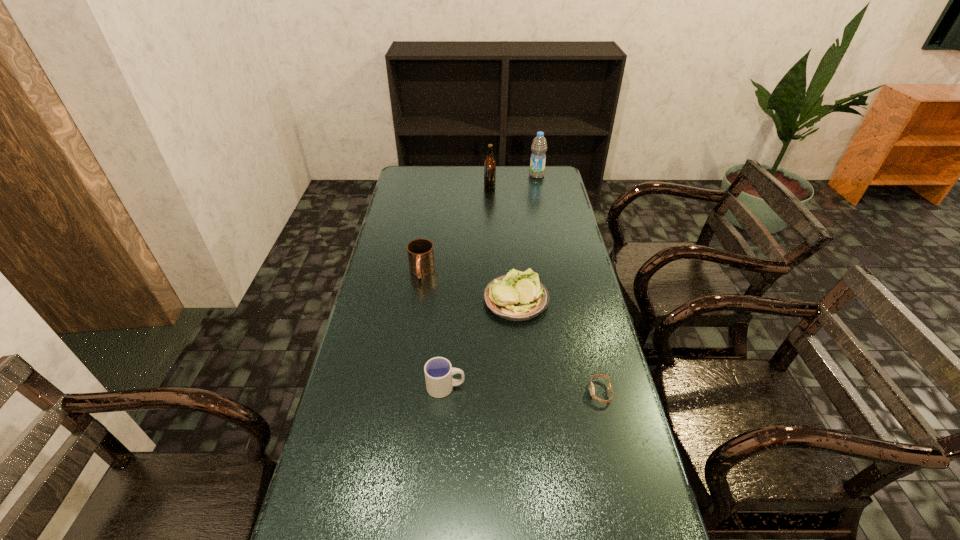
Where is `free spot between the mug and the watch`? The height and width of the screenshot is (540, 960). free spot between the mug and the watch is located at coordinates (511, 332).

Image resolution: width=960 pixels, height=540 pixels. I want to click on free point between the cup and the mug, so click(x=434, y=329).

I want to click on vacant space that is in between the lettuce and the second farthest object, so click(503, 242).

In order to click on vacant area that lies between the cup and the lettuce in this screenshot , I will do `click(481, 343)`.

Find the location of a particular element. Image resolution: width=960 pixels, height=540 pixels. unoccupied position between the mug and the beer bottle is located at coordinates [x=456, y=228].

Locate which object is the second closest to the fifth nearest object. Please provide its 2D coordinates. Your answer should be formatted as a tuple, i.e. [(x, y)], where the tuple contains the x and y coordinates of a point satisfying the conditions above.

[(420, 252)]

Where is `object that can be found as the fourth closest to the cup`? This screenshot has width=960, height=540. object that can be found as the fourth closest to the cup is located at coordinates (489, 164).

Where is `vacant position in the image that satisfies the following two spatial constraints: 1. on the front side of the lettuce; 2. with the handle on the side of the second object from left to right`? The width and height of the screenshot is (960, 540). vacant position in the image that satisfies the following two spatial constraints: 1. on the front side of the lettuce; 2. with the handle on the side of the second object from left to right is located at coordinates (524, 387).

At what (x,y) coordinates should I click in order to perform the action: click on free space that satisfies the following two spatial constraints: 1. on the label of the fifth nearest object; 2. on the side of the mug with the handle. Please return your answer as a coordinate pair (x, y). This screenshot has height=540, width=960. Looking at the image, I should click on (492, 271).

This screenshot has width=960, height=540. What are the coordinates of `free space that satisfies the following two spatial constraints: 1. on the side of the lettuce with the handle; 2. on the left side of the mug` in the screenshot? It's located at click(x=418, y=299).